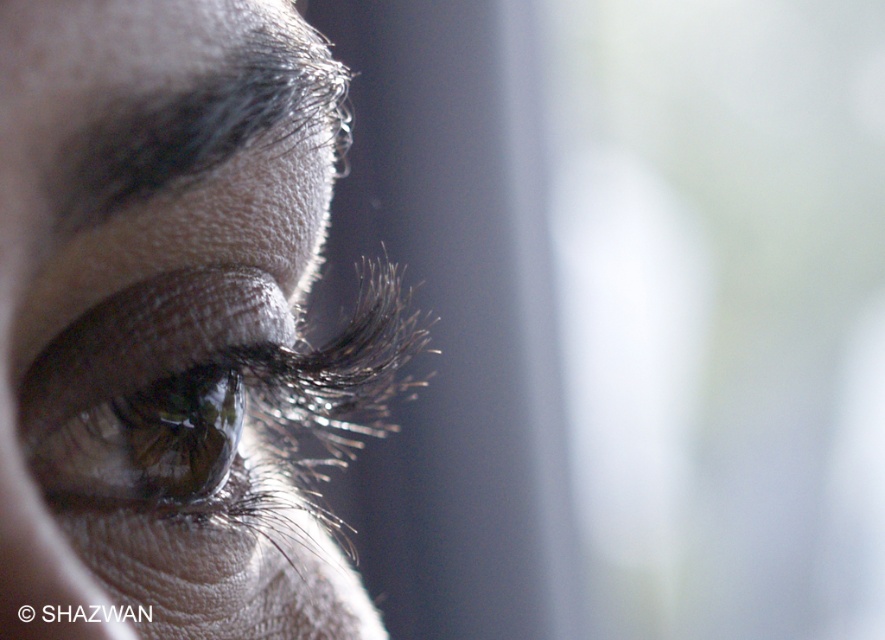
Question: Is the position of matte skin eye at center less distant than that of brown glossy eye at center?

Choices:
 (A) yes
 (B) no

Answer: (A)

Question: Is matte skin eye at center below brown glossy eye at center?

Choices:
 (A) yes
 (B) no

Answer: (B)

Question: Which object is positioned farthest from the brown glossy eye at center?

Choices:
 (A) matte skin eye at center
 (B) dark matte eyebrow at upper left

Answer: (B)

Question: Does dark matte eyebrow at upper left have a larger size compared to brown glossy eye at center?

Choices:
 (A) no
 (B) yes

Answer: (B)

Question: Which of these objects is positioned farthest from the dark matte eyebrow at upper left?

Choices:
 (A) brown glossy eye at center
 (B) matte skin eye at center

Answer: (A)

Question: Which of the following is the closest to the observer?

Choices:
 (A) dark matte eyebrow at upper left
 (B) brown glossy eye at center
 (C) matte skin eye at center

Answer: (C)